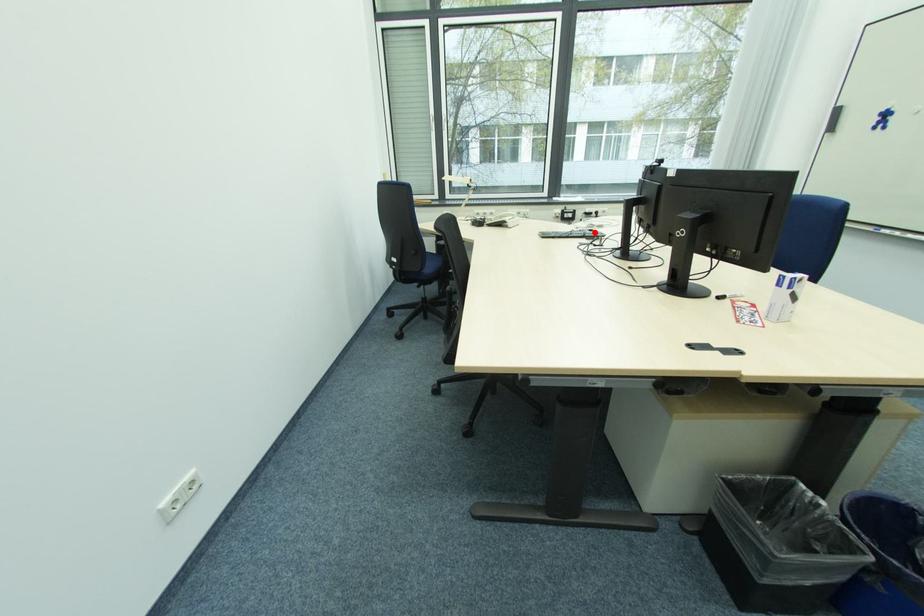
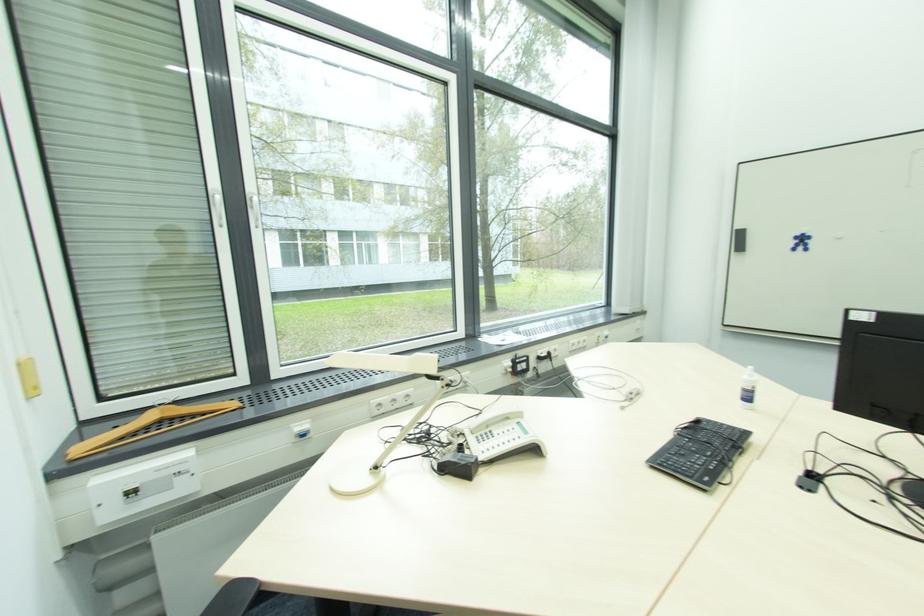
Find the pixel in the second image that matches the highlighted location in the first image.

(700, 424)